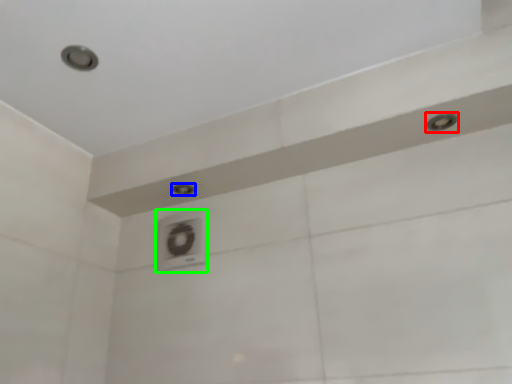
Question: Considering the real-world distances, which object is farthest from shower (highlighted by a red box)? shower (highlighted by a blue box) or air conditioner (highlighted by a green box)?

Choices:
 (A) shower
 (B) air conditioner

Answer: (B)